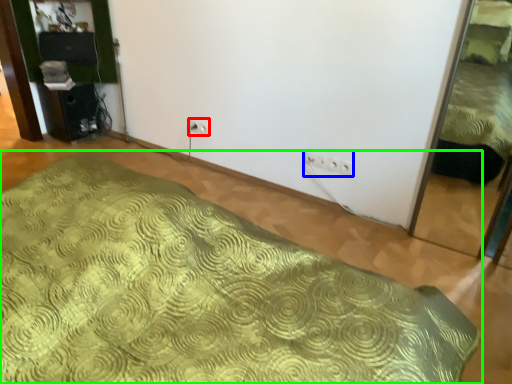
Question: Considering the real-world distances, which object is farthest from electric outlet (highlighted by a red box)? electric outlet (highlighted by a blue box) or bed (highlighted by a green box)?

Choices:
 (A) electric outlet
 (B) bed

Answer: (B)